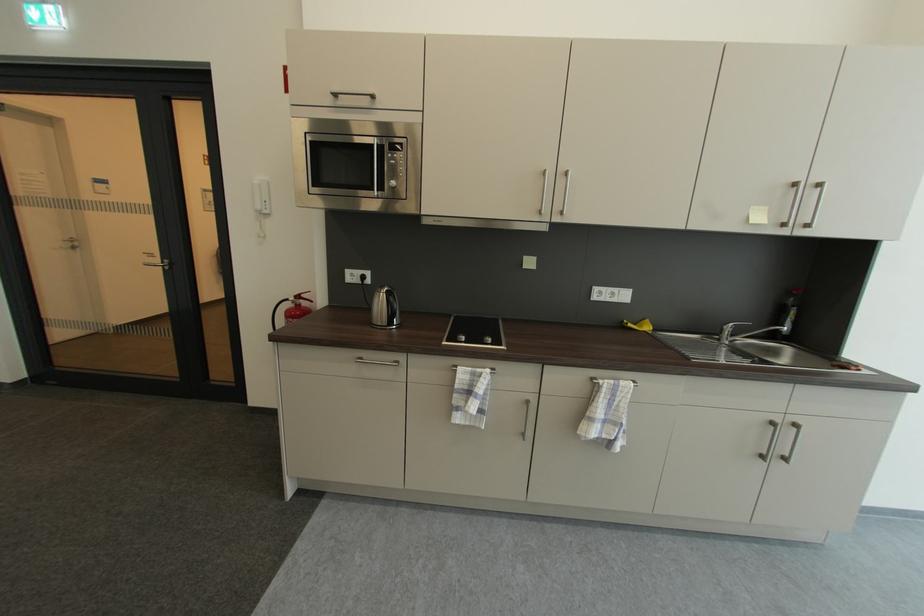
Locate an element on the screen. The image size is (924, 616). fire extinguisher lever is located at coordinates (300, 301).